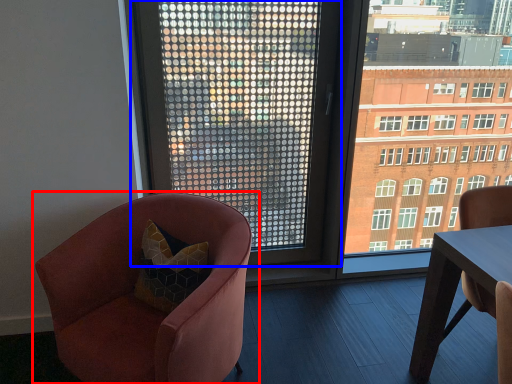
Question: Which object appears farthest to the camera in this image, chair (highlighted by a red box) or window (highlighted by a blue box)?

Choices:
 (A) chair
 (B) window

Answer: (B)